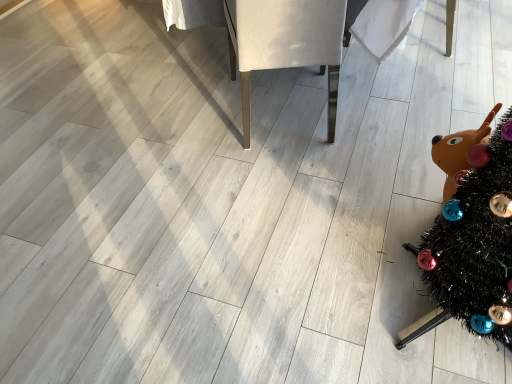
Question: Is black tinsel christmas tree at lower right to the left of white fabric chair at center from the viewer's perspective?

Choices:
 (A) yes
 (B) no

Answer: (B)

Question: Is black tinsel christmas tree at lower right shorter than white fabric chair at center?

Choices:
 (A) yes
 (B) no

Answer: (B)

Question: Is black tinsel christmas tree at lower right further to the viewer compared to white fabric chair at center?

Choices:
 (A) no
 (B) yes

Answer: (A)

Question: From the image's perspective, is black tinsel christmas tree at lower right on top of white fabric chair at center?

Choices:
 (A) no
 (B) yes

Answer: (A)

Question: Considering the relative sizes of black tinsel christmas tree at lower right and white fabric chair at center in the image provided, is black tinsel christmas tree at lower right bigger than white fabric chair at center?

Choices:
 (A) no
 (B) yes

Answer: (A)

Question: Is the position of black tinsel christmas tree at lower right less distant than that of white fabric chair at center?

Choices:
 (A) yes
 (B) no

Answer: (A)

Question: Is the surface of white fabric chair at center in direct contact with black tinsel christmas tree at lower right?

Choices:
 (A) yes
 (B) no

Answer: (B)

Question: Considering the relative sizes of white fabric chair at center and black tinsel christmas tree at lower right in the image provided, is white fabric chair at center wider than black tinsel christmas tree at lower right?

Choices:
 (A) no
 (B) yes

Answer: (B)

Question: From the image's perspective, would you say white fabric chair at center is positioned over black tinsel christmas tree at lower right?

Choices:
 (A) yes
 (B) no

Answer: (A)

Question: Is black tinsel christmas tree at lower right completely or partially inside white fabric chair at center?

Choices:
 (A) no
 (B) yes

Answer: (A)

Question: Does white fabric chair at center have a smaller size compared to black tinsel christmas tree at lower right?

Choices:
 (A) yes
 (B) no

Answer: (B)

Question: Can you confirm if white fabric chair at center is taller than black tinsel christmas tree at lower right?

Choices:
 (A) yes
 (B) no

Answer: (B)

Question: Is white fabric chair at center situated inside black tinsel christmas tree at lower right or outside?

Choices:
 (A) outside
 (B) inside

Answer: (A)